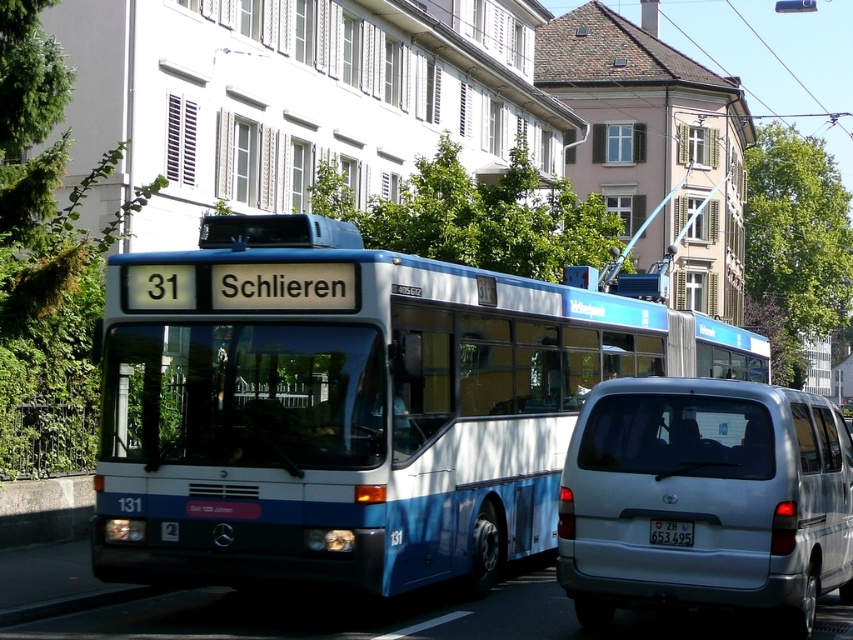
Question: Is silver metallic van at lower right smaller than white plastic license plate at center?

Choices:
 (A) yes
 (B) no

Answer: (B)

Question: Can you confirm if blue metallic bus at center is positioned below white plastic license plate at center?

Choices:
 (A) yes
 (B) no

Answer: (A)

Question: Which object is farther from the camera taking this photo?

Choices:
 (A) white plastic license plate at center
 (B) blue metallic bus at center

Answer: (B)

Question: Which of the following is the farthest from the observer?

Choices:
 (A) (653, 524)
 (B) (534, 307)

Answer: (B)

Question: Which object is positioned farthest from the blue metallic bus at center?

Choices:
 (A) white plastic license plate at center
 (B) silver metallic van at lower right

Answer: (B)

Question: Is blue metallic bus at center below silver metallic van at lower right?

Choices:
 (A) yes
 (B) no

Answer: (A)